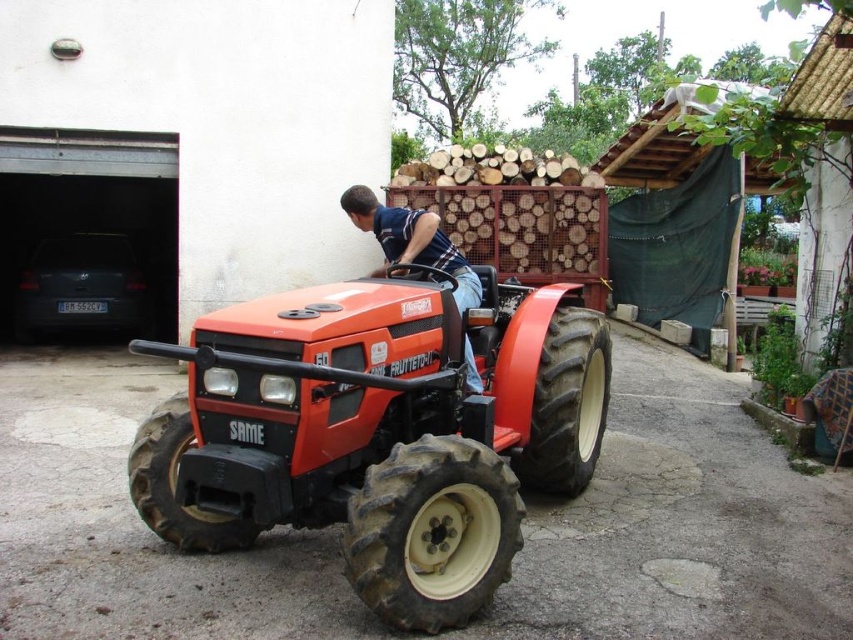
Is matte orange tractor at center positioned at the back of blue striped shirt at center?

No, it is in front of blue striped shirt at center.

Can you confirm if matte orange tractor at center is wider than blue striped shirt at center?

Correct, the width of matte orange tractor at center exceeds that of blue striped shirt at center.

What do you see at coordinates (378, 432) in the screenshot?
I see `matte orange tractor at center` at bounding box center [378, 432].

Identify the location of matte orange tractor at center. (378, 432).